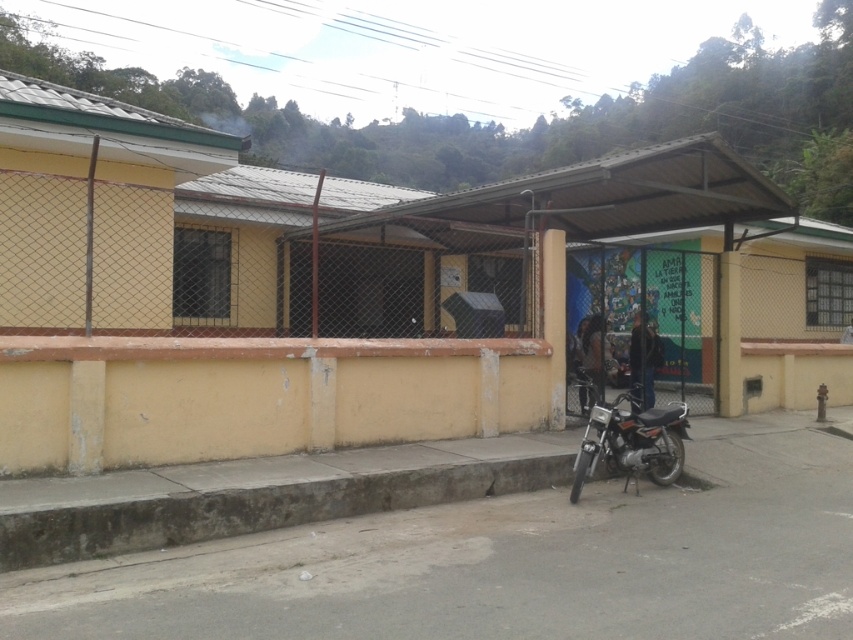
Question: Observing the image, what is the correct spatial positioning of concrete at lower left in reference to metallic silver motorcycle at lower right?

Choices:
 (A) left
 (B) right

Answer: (A)

Question: Is concrete at lower left to the left of metallic silver motorcycle at lower right from the viewer's perspective?

Choices:
 (A) no
 (B) yes

Answer: (B)

Question: From the image, what is the correct spatial relationship of concrete at lower left in relation to metallic silver motorcycle at lower right?

Choices:
 (A) below
 (B) above

Answer: (A)

Question: Among these objects, which one is nearest to the camera?

Choices:
 (A) concrete at lower left
 (B) metallic silver motorcycle at lower right

Answer: (A)